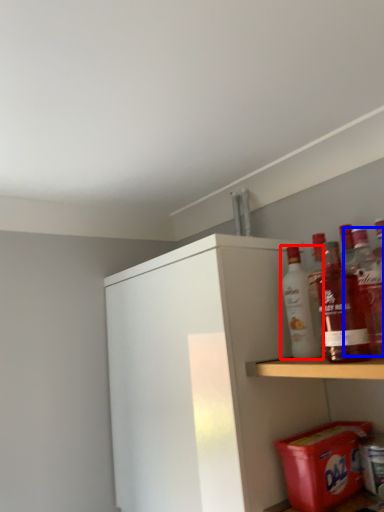
Question: Which of the following is the farthest to the observer, bottle (highlighted by a red box) or bottle (highlighted by a blue box)?

Choices:
 (A) bottle
 (B) bottle

Answer: (A)